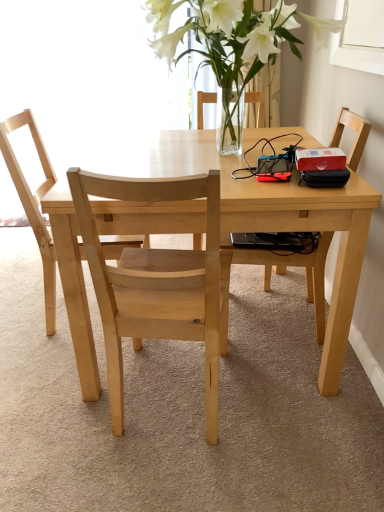
Question: Is natural wood chair at center, the 1th chair viewed from the left, positioned far away from light brown wooden chair at right, which ranks as the first chair in right-to-left order?

Choices:
 (A) yes
 (B) no

Answer: (A)

Question: Is natural wood chair at center, the 1th chair viewed from the left, not within light brown wooden chair at right, the third chair when ordered from left to right?

Choices:
 (A) yes
 (B) no

Answer: (A)

Question: Is natural wood chair at center, the 3th chair from the right, wider than light brown wooden chair at right, which ranks as the first chair in right-to-left order?

Choices:
 (A) no
 (B) yes

Answer: (B)

Question: Are natural wood chair at center, the 1th chair viewed from the left, and light brown wooden chair at right, the third chair when ordered from left to right, making contact?

Choices:
 (A) yes
 (B) no

Answer: (B)

Question: From the image's perspective, would you say natural wood chair at center, the 3th chair from the right, is shown under light brown wooden chair at right, the third chair when ordered from left to right?

Choices:
 (A) no
 (B) yes

Answer: (A)

Question: Does natural wood chair at center, the 1th chair viewed from the left, have a larger size compared to light brown wooden chair at right, which ranks as the first chair in right-to-left order?

Choices:
 (A) yes
 (B) no

Answer: (A)

Question: Does light wood table at center have a greater height compared to natural wood chair at center, the 3th chair from the right?

Choices:
 (A) no
 (B) yes

Answer: (A)

Question: Is light wood table at center to the left of natural wood chair at center, the 3th chair from the right, from the viewer's perspective?

Choices:
 (A) no
 (B) yes

Answer: (A)

Question: Is light wood table at center positioned with its back to natural wood chair at center, the 3th chair from the right?

Choices:
 (A) no
 (B) yes

Answer: (A)

Question: From the image's perspective, is light wood table at center below natural wood chair at center, the 1th chair viewed from the left?

Choices:
 (A) yes
 (B) no

Answer: (A)

Question: Is the depth of light wood table at center greater than that of natural wood chair at center, the 3th chair from the right?

Choices:
 (A) no
 (B) yes

Answer: (A)

Question: Considering the relative sizes of light wood table at center and natural wood chair at center, the 1th chair viewed from the left, in the image provided, is light wood table at center bigger than natural wood chair at center, the 1th chair viewed from the left,?

Choices:
 (A) no
 (B) yes

Answer: (B)

Question: Does natural wood chair at center, the 3th chair from the right, appear on the right side of natural wood chair at center, which is the second chair from left to right?

Choices:
 (A) yes
 (B) no

Answer: (B)